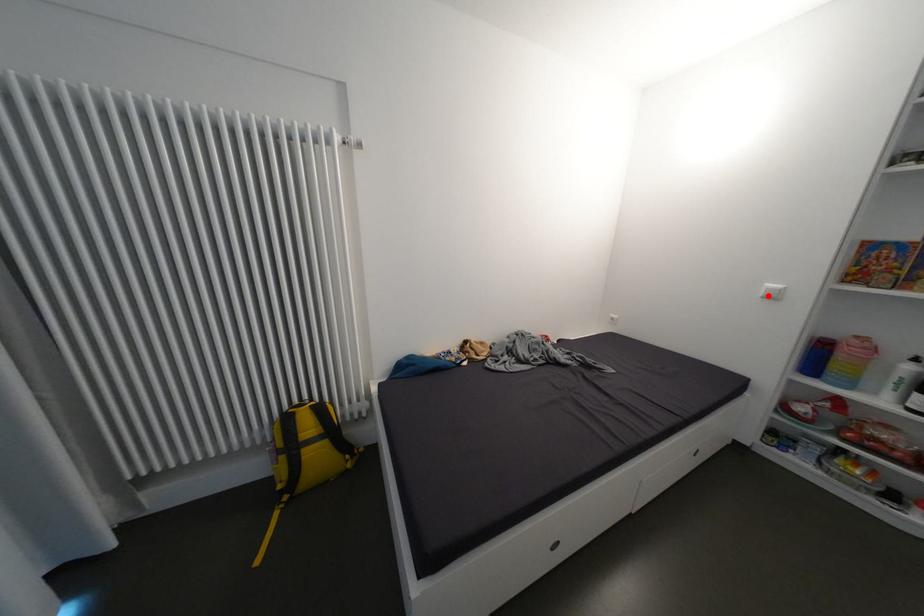
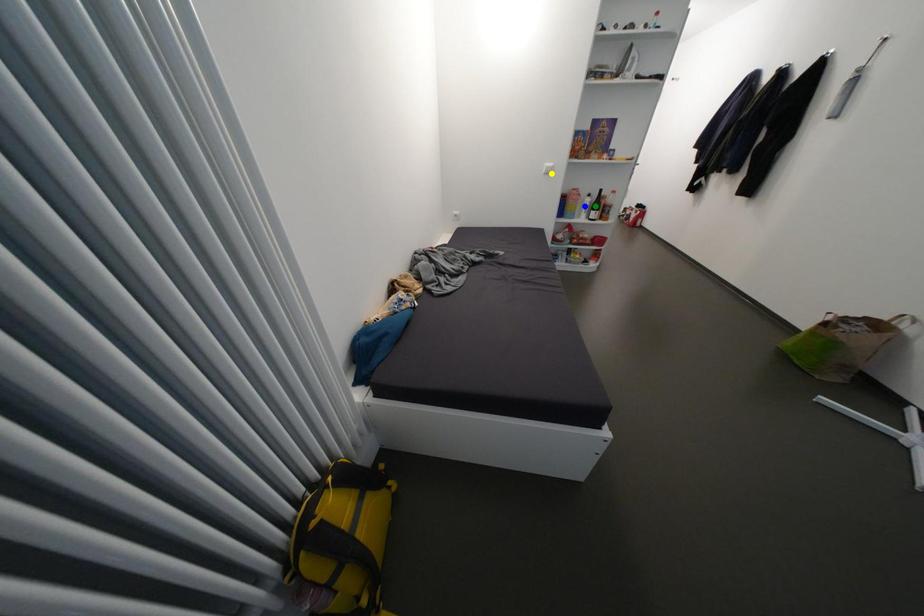
Question: I am providing you with two images of the same scene from different viewpoints. A red point is marked on the first image. You are given multiple points on the second image. Which point in image 2 represents the same 3d spot as the red point in image 1?

Choices:
 (A) green point
 (B) blue point
 (C) yellow point

Answer: (C)